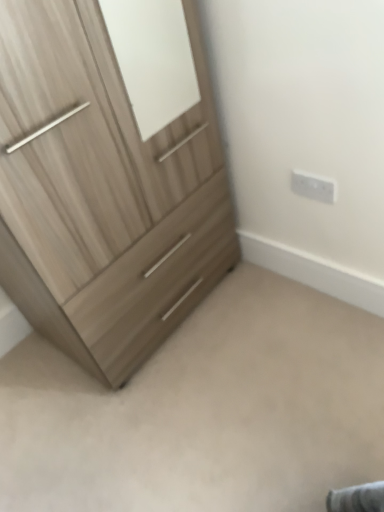
The height and width of the screenshot is (512, 384). What do you see at coordinates (204, 410) in the screenshot?
I see `light wood dresser at lower left` at bounding box center [204, 410].

Where is `light wood/texture chest of drawers at left`? Image resolution: width=384 pixels, height=512 pixels. light wood/texture chest of drawers at left is located at coordinates (103, 192).

Identify the location of white plastic electric outlet at upper right. (314, 186).

Considering the relative sizes of white plastic electric outlet at upper right and light wood dresser at lower left in the image provided, is white plastic electric outlet at upper right thinner than light wood dresser at lower left?

Correct, the width of white plastic electric outlet at upper right is less than that of light wood dresser at lower left.

Does point (302, 175) come behind point (317, 357)?

That is False.

Looking at this image, in the image, is white plastic electric outlet at upper right positioned in front of or behind light wood dresser at lower left?

Visually, white plastic electric outlet at upper right is located behind light wood dresser at lower left.

How different are the orientations of white plastic electric outlet at upper right and light wood dresser at lower left in degrees?

0.0448 degrees.

From the image's perspective, is light wood dresser at lower left located beneath white plastic electric outlet at upper right?

Correct, light wood dresser at lower left appears lower than white plastic electric outlet at upper right in the image.

From a real-world perspective, is light wood dresser at lower left above or below white plastic electric outlet at upper right?

Clearly, from a real-world perspective, light wood dresser at lower left is below white plastic electric outlet at upper right.

Is light wood dresser at lower left smaller than white plastic electric outlet at upper right?

Actually, light wood dresser at lower left might be larger than white plastic electric outlet at upper right.

Is light wood dresser at lower left far from white plastic electric outlet at upper right?

No, light wood dresser at lower left is not far away from white plastic electric outlet at upper right.

Considering the relative sizes of light wood dresser at lower left and light wood/texture chest of drawers at left in the image provided, is light wood dresser at lower left taller than light wood/texture chest of drawers at left?

No, light wood dresser at lower left is not taller than light wood/texture chest of drawers at left.

Is light wood dresser at lower left positioned far away from light wood/texture chest of drawers at left?

Actually, light wood dresser at lower left and light wood/texture chest of drawers at left are a little close together.

How distant is light wood dresser at lower left from light wood/texture chest of drawers at left?

They are 17.94 inches apart.

Is light wood dresser at lower left facing away from light wood/texture chest of drawers at left?

light wood dresser at lower left does not have its back to light wood/texture chest of drawers at left.

Is light wood dresser at lower left at the back of light wood/texture chest of drawers at left?

No, light wood/texture chest of drawers at left's orientation is not away from light wood dresser at lower left.

Is light wood/texture chest of drawers at left closer to the viewer compared to light wood dresser at lower left?

Yes, light wood/texture chest of drawers at left is in front of light wood dresser at lower left.

Is light wood/texture chest of drawers at left outside of light wood dresser at lower left?

light wood/texture chest of drawers at left lies outside light wood dresser at lower left's area.

From the image's perspective, relative to light wood dresser at lower left, is light wood/texture chest of drawers at left above or below?

From the image's perspective, light wood/texture chest of drawers at left appears above light wood dresser at lower left.

Can we say light wood/texture chest of drawers at left lies outside white plastic electric outlet at upper right?

Yes, light wood/texture chest of drawers at left is not within white plastic electric outlet at upper right.

Would you say light wood/texture chest of drawers at left is to the left or to the right of white plastic electric outlet at upper right in the picture?

Based on their positions, light wood/texture chest of drawers at left is located to the left of white plastic electric outlet at upper right.

In terms of width, does light wood/texture chest of drawers at left look wider or thinner when compared to white plastic electric outlet at upper right?

Considering their sizes, light wood/texture chest of drawers at left looks broader than white plastic electric outlet at upper right.

Does light wood/texture chest of drawers at left have a greater height compared to white plastic electric outlet at upper right?

Yes, light wood/texture chest of drawers at left is taller than white plastic electric outlet at upper right.

Can you confirm if white plastic electric outlet at upper right is thinner than light wood/texture chest of drawers at left?

Correct, the width of white plastic electric outlet at upper right is less than that of light wood/texture chest of drawers at left.

Is point (304, 196) positioned in front of point (71, 169)?

No, it is behind (71, 169).

How much distance is there between white plastic electric outlet at upper right and light wood/texture chest of drawers at left?

white plastic electric outlet at upper right is 22.77 inches away from light wood/texture chest of drawers at left.

From a real-world perspective, is white plastic electric outlet at upper right physically located above or below light wood/texture chest of drawers at left?

Clearly, from a real-world perspective, white plastic electric outlet at upper right is below light wood/texture chest of drawers at left.

I want to click on electric outlet above the light wood dresser at lower left (from a real-world perspective), so click(314, 186).

What are the coordinates of `electric outlet behind the light wood dresser at lower left` in the screenshot? It's located at (314, 186).

In the scene shown: Estimate the real-world distances between objects in this image. Which object is closer to light wood dresser at lower left, white plastic electric outlet at upper right or light wood/texture chest of drawers at left?

Among the two, light wood/texture chest of drawers at left is located nearer to light wood dresser at lower left.

Looking at the image, which one is located closer to white plastic electric outlet at upper right, light wood dresser at lower left or light wood/texture chest of drawers at left?

light wood/texture chest of drawers at left is positioned closer to the anchor white plastic electric outlet at upper right.

Considering their positions, is light wood/texture chest of drawers at left positioned closer to white plastic electric outlet at upper right than light wood dresser at lower left?

Among the two, light wood/texture chest of drawers at left is located nearer to white plastic electric outlet at upper right.

From the image, which object appears to be nearer to light wood dresser at lower left, light wood/texture chest of drawers at left or white plastic electric outlet at upper right?

light wood/texture chest of drawers at left is positioned closer to the anchor light wood dresser at lower left.

From the picture: When comparing their distances from light wood/texture chest of drawers at left, does white plastic electric outlet at upper right or light wood dresser at lower left seem further?

white plastic electric outlet at upper right.

Which object lies further to the anchor point light wood/texture chest of drawers at left, light wood dresser at lower left or white plastic electric outlet at upper right?

white plastic electric outlet at upper right is positioned further to the anchor light wood/texture chest of drawers at left.

What are the coordinates of `electric outlet between light wood/texture chest of drawers at left and light wood dresser at lower left in the up-down direction` in the screenshot? It's located at (314, 186).